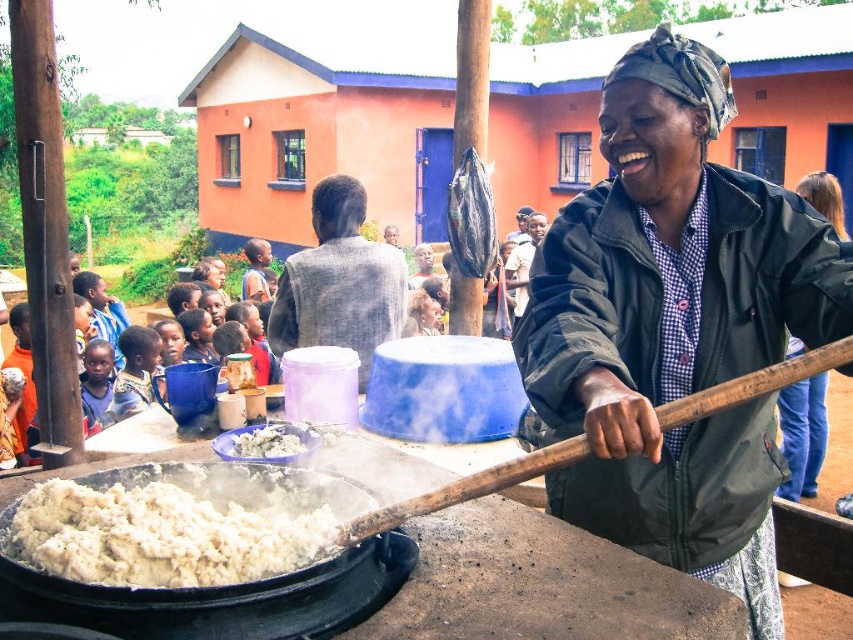
The width and height of the screenshot is (853, 640). What do you see at coordinates (135, 371) in the screenshot?
I see `light brown skin at center` at bounding box center [135, 371].

Is light brown skin at center closer to camera compared to dark blue fabric shirt at left?

No, light brown skin at center is further to the viewer.

Which is in front, point (126, 372) or point (108, 364)?

Positioned in front is point (108, 364).

You are a GUI agent. You are given a task and a screenshot of the screen. Output one action in this format:
    pyautogui.click(x=<x>, y=<y>)
    Task: Click on the light brown skin at center
    The width and height of the screenshot is (853, 640).
    Given the screenshot: What is the action you would take?
    pyautogui.click(x=135, y=371)

Does light brown skin at center appear on the left side of white fluffy food at center?

Indeed, light brown skin at center is positioned on the left side of white fluffy food at center.

You are a GUI agent. You are given a task and a screenshot of the screen. Output one action in this format:
    pyautogui.click(x=<x>, y=<y>)
    Task: Click on the light brown skin at center
    Image resolution: width=853 pixels, height=640 pixels.
    Given the screenshot: What is the action you would take?
    pyautogui.click(x=135, y=371)

Who is lower down, green checkered shirt at center or white fluffy food at center?

Positioned lower is white fluffy food at center.

Can you confirm if green checkered shirt at center is bigger than white fluffy food at center?

Yes.

Image resolution: width=853 pixels, height=640 pixels. What do you see at coordinates (675, 326) in the screenshot? I see `green checkered shirt at center` at bounding box center [675, 326].

At what (x,y) coordinates should I click in order to perform the action: click on green checkered shirt at center. Please return your answer as a coordinate pair (x, y). Looking at the image, I should click on (675, 326).